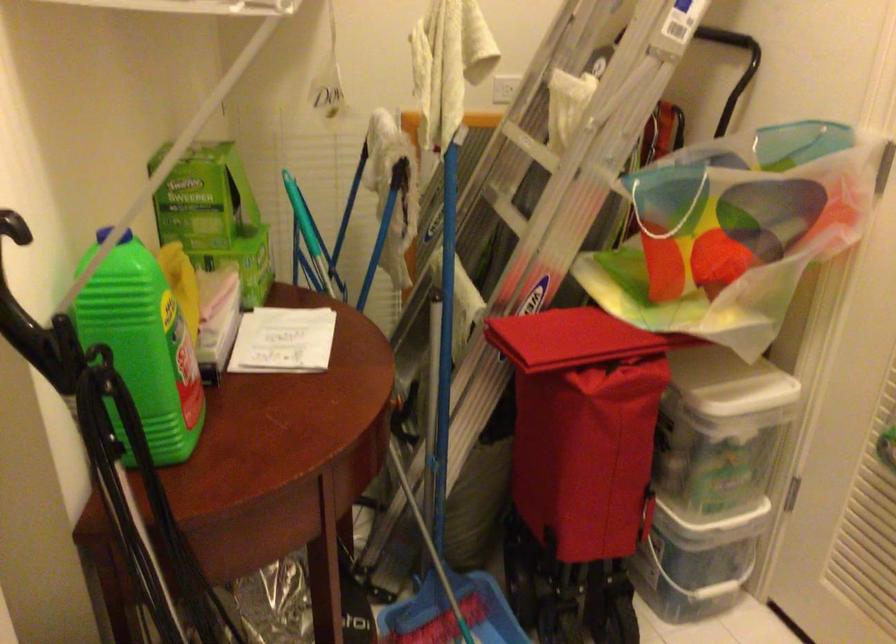
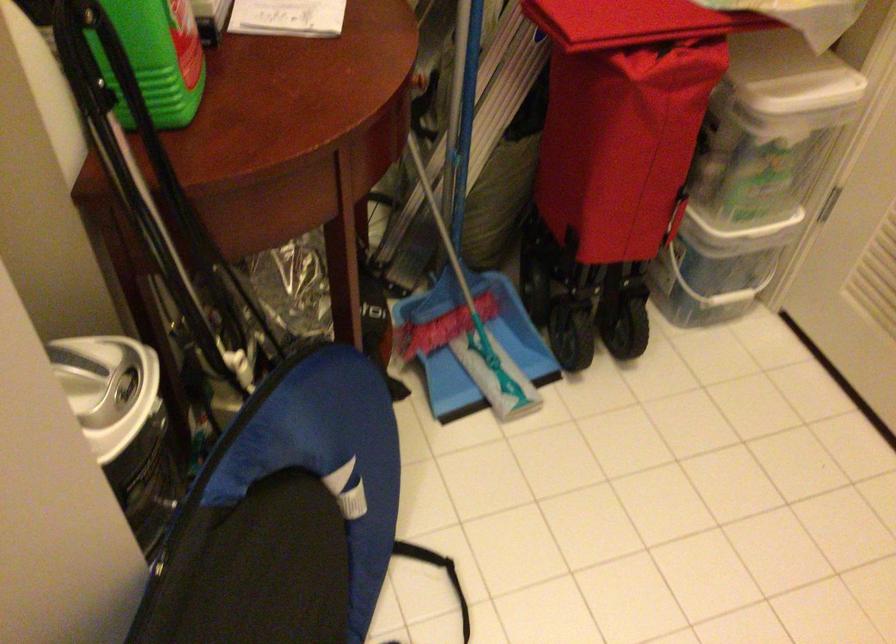
Where in the second image is the point corresponding to (435,391) from the first image?

(460, 71)